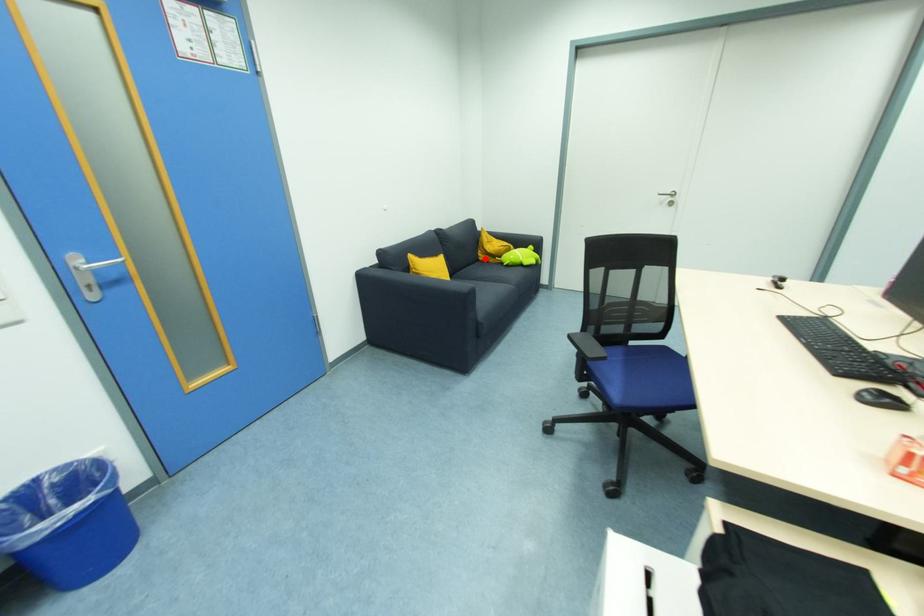
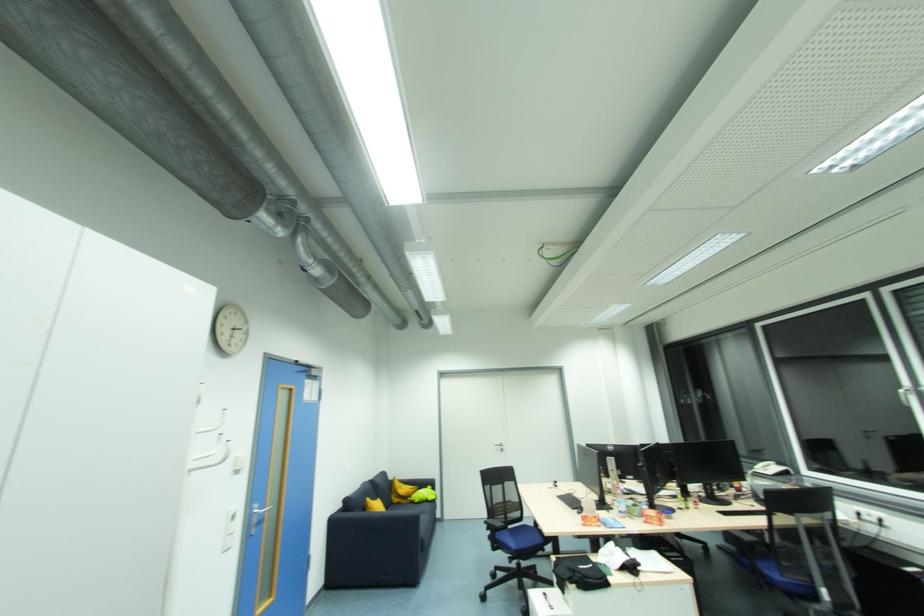
Question: I am providing you with two images of the same scene from different viewpoints. A red point is shown in image1. For the corresponding object point in image2, is it positioned nearer or farther from the camera?

Choices:
 (A) Nearer
 (B) Farther

Answer: (B)